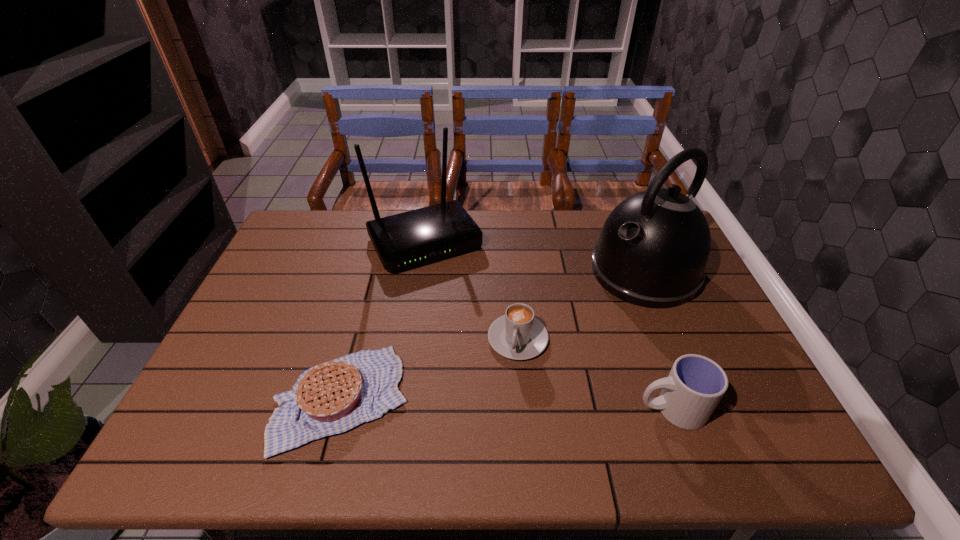
This screenshot has height=540, width=960. Find the location of `kettle present at the far edge`. kettle present at the far edge is located at coordinates coord(652,252).

You are a GUI agent. You are given a task and a screenshot of the screen. Output one action in this format:
    pyautogui.click(x=<x>, y=<y>)
    Task: Click on the pie at the near edge
    The width and height of the screenshot is (960, 540).
    Given the screenshot: What is the action you would take?
    pyautogui.click(x=333, y=397)

The image size is (960, 540). In order to click on cup positioned at the near edge in this screenshot , I will do `click(695, 385)`.

At what (x,y) coordinates should I click in order to perform the action: click on cup that is at the right edge. Please return your answer as a coordinate pair (x, y). Image resolution: width=960 pixels, height=540 pixels. Looking at the image, I should click on (695, 385).

Where is `kettle present at the right edge`? This screenshot has height=540, width=960. kettle present at the right edge is located at coordinates (652, 252).

Locate an element on the screen. The image size is (960, 540). object that is at the far right corner is located at coordinates (652, 252).

Identify the location of object located in the near right corner section of the desktop. (695, 385).

Where is `vacant space at the far edge`? vacant space at the far edge is located at coordinates (362, 246).

At what (x,y) coordinates should I click in order to perform the action: click on vacant space at the near edge of the desktop. Please return your answer as a coordinate pair (x, y). Looking at the image, I should click on (557, 385).

This screenshot has height=540, width=960. Identify the location of vacant space at the left edge of the desktop. (262, 323).